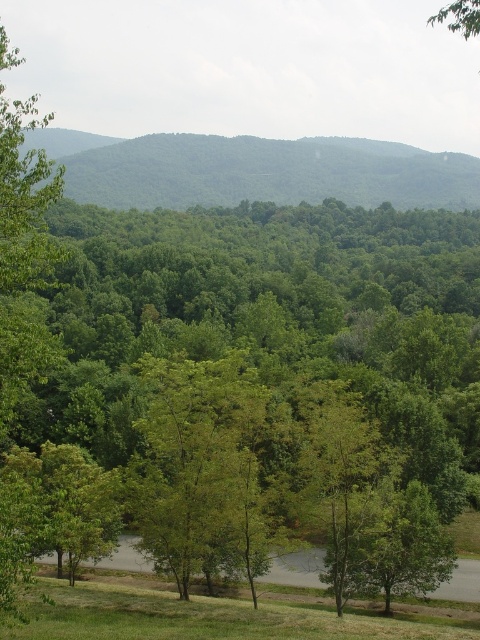
Between green leafy tree at center and green leafy forest at upper center, which one appears on the right side from the viewer's perspective?

green leafy tree at center is more to the right.

Which is behind, point (408, 285) or point (212, 198)?

The point (212, 198) is more distant.

This screenshot has height=640, width=480. Identify the location of green leafy tree at center. (x=266, y=323).

Identify the location of green leafy tree at center. This screenshot has height=640, width=480. click(x=266, y=323).

Which is more to the right, green leafy tree at center or green grassy at lower center?

Positioned to the right is green leafy tree at center.

Is point (418, 353) closer to camera compared to point (103, 604)?

No, it is not.

You are a GUI agent. You are given a task and a screenshot of the screen. Output one action in this format:
    pyautogui.click(x=<x>, y=<y>)
    Task: Click on the green leafy tree at center
    
    Given the screenshot: What is the action you would take?
    pyautogui.click(x=266, y=323)

Does green leafy forest at upper center have a lesser width compared to green grassy at lower center?

Incorrect, green leafy forest at upper center's width is not less than green grassy at lower center's.

The image size is (480, 640). What do you see at coordinates (255, 170) in the screenshot?
I see `green leafy forest at upper center` at bounding box center [255, 170].

This screenshot has width=480, height=640. In order to click on green leafy forest at upper center in this screenshot , I will do `click(255, 170)`.